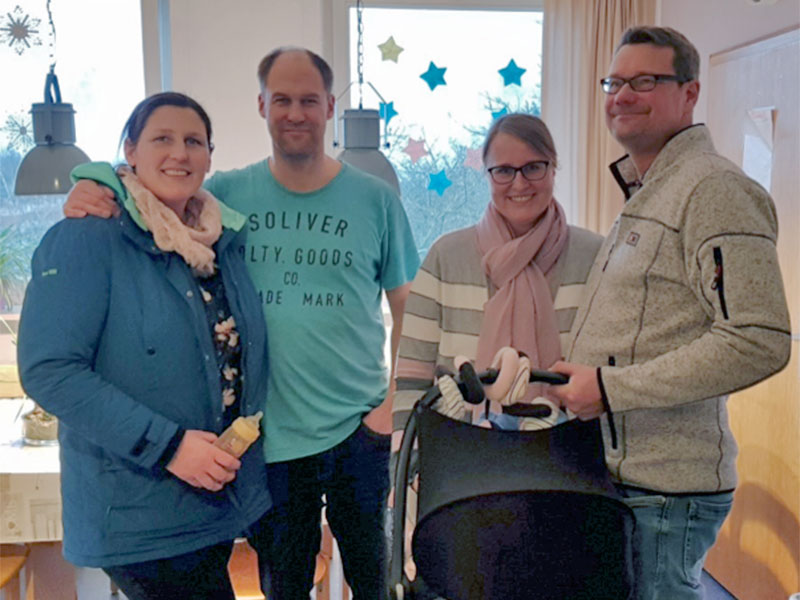
The width and height of the screenshot is (800, 600). What are the coordinates of `bottle for feeding baby` in the screenshot? It's located at (234, 431).